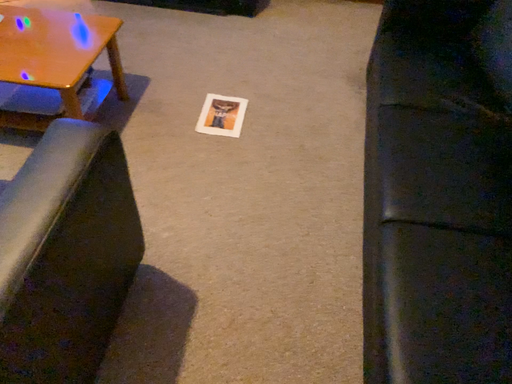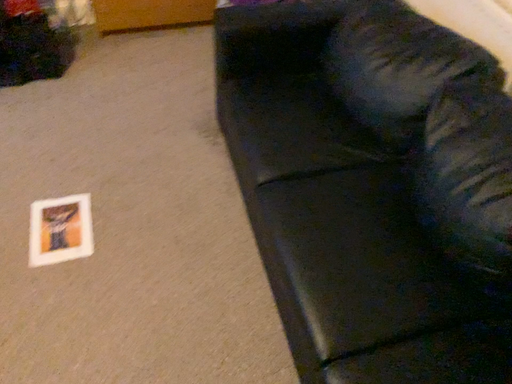
Question: How did the camera likely rotate when shooting the video?

Choices:
 (A) rotated left
 (B) rotated right

Answer: (B)